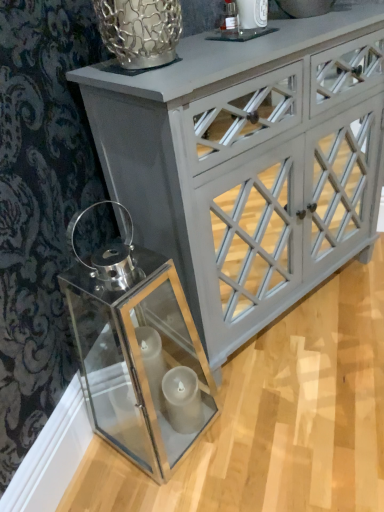
Question: Can you confirm if white painted wood cabinet at upper center is bigger than clear glass lantern at lower left?

Choices:
 (A) yes
 (B) no

Answer: (A)

Question: From a real-world perspective, is white painted wood cabinet at upper center below clear glass lantern at lower left?

Choices:
 (A) yes
 (B) no

Answer: (B)

Question: Considering the relative positions of white painted wood cabinet at upper center and clear glass lantern at lower left in the image provided, is white painted wood cabinet at upper center behind clear glass lantern at lower left?

Choices:
 (A) yes
 (B) no

Answer: (A)

Question: Is white painted wood cabinet at upper center facing away from clear glass lantern at lower left?

Choices:
 (A) yes
 (B) no

Answer: (B)

Question: Does white painted wood cabinet at upper center touch clear glass lantern at lower left?

Choices:
 (A) yes
 (B) no

Answer: (B)

Question: Is clear glass lantern at lower left a part of white painted wood cabinet at upper center?

Choices:
 (A) no
 (B) yes

Answer: (A)

Question: Considering the relative positions of clear glass lantern at lower left and white painted wood cabinet at upper center in the image provided, is clear glass lantern at lower left to the right of white painted wood cabinet at upper center from the viewer's perspective?

Choices:
 (A) yes
 (B) no

Answer: (B)

Question: Considering the relative sizes of clear glass lantern at lower left and white painted wood cabinet at upper center in the image provided, is clear glass lantern at lower left bigger than white painted wood cabinet at upper center?

Choices:
 (A) no
 (B) yes

Answer: (A)

Question: Does clear glass lantern at lower left have a smaller size compared to white painted wood cabinet at upper center?

Choices:
 (A) no
 (B) yes

Answer: (B)

Question: Can white painted wood cabinet at upper center be found inside clear glass lantern at lower left?

Choices:
 (A) yes
 (B) no

Answer: (B)

Question: Considering the relative sizes of clear glass lantern at lower left and white painted wood cabinet at upper center in the image provided, is clear glass lantern at lower left shorter than white painted wood cabinet at upper center?

Choices:
 (A) yes
 (B) no

Answer: (A)

Question: Is clear glass lantern at lower left next to white painted wood cabinet at upper center?

Choices:
 (A) no
 (B) yes

Answer: (A)

Question: In terms of height, does white painted wood cabinet at upper center look taller or shorter compared to clear glass lantern at lower left?

Choices:
 (A) tall
 (B) short

Answer: (A)